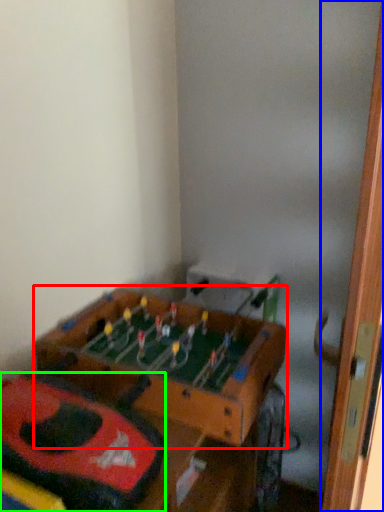
Question: Which is farther away from table (highlighted by a red box)? door (highlighted by a blue box) or kit (highlighted by a green box)?

Choices:
 (A) door
 (B) kit

Answer: (A)